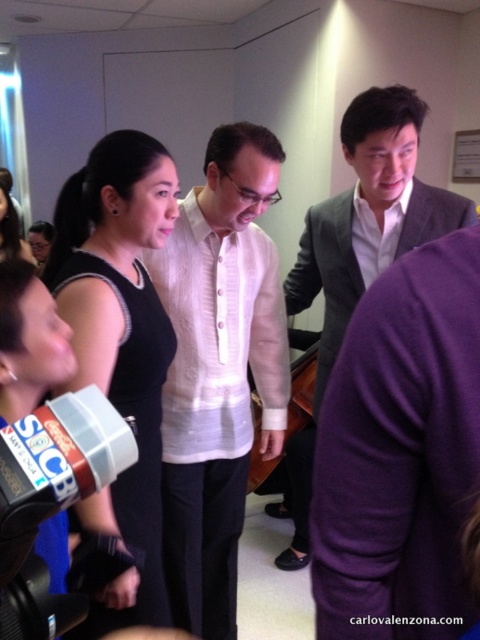
Question: Can you confirm if gray wool suit at center is thinner than black plastic video camera at lower left?

Choices:
 (A) no
 (B) yes

Answer: (A)

Question: Where is white linen shirt at center located in relation to black matte dress at center in the image?

Choices:
 (A) left
 (B) right

Answer: (B)

Question: Which point is farther to the camera?

Choices:
 (A) (368, 278)
 (B) (83, 424)

Answer: (A)

Question: Based on their relative distances, which object is farther from the black plastic video camera at lower left?

Choices:
 (A) gray wool suit at center
 (B) white linen shirt at center
 (C) black matte dress at center

Answer: (A)

Question: Can you confirm if black matte dress at center is positioned above black plastic video camera at lower left?

Choices:
 (A) yes
 (B) no

Answer: (A)

Question: Which object is the farthest from the black matte dress at center?

Choices:
 (A) white linen shirt at center
 (B) gray wool suit at center
 (C) black plastic video camera at lower left

Answer: (B)